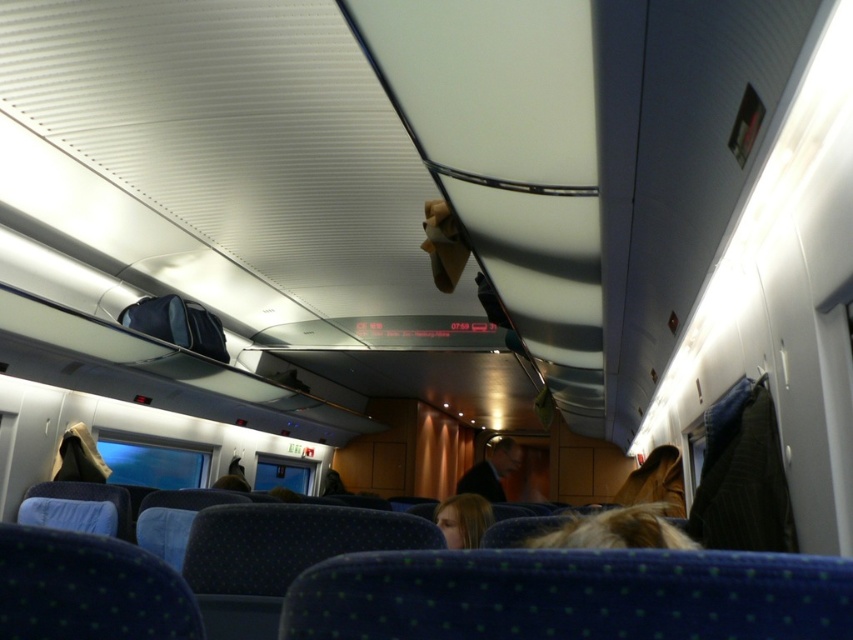
Question: From the image, what is the correct spatial relationship of blonde hair at lower center in relation to dark blue fabric jacket at center?

Choices:
 (A) below
 (B) above

Answer: (B)

Question: Does blonde hair at lower center have a lesser width compared to dark blue fabric jacket at center?

Choices:
 (A) no
 (B) yes

Answer: (B)

Question: Can you confirm if blonde hair at lower center is positioned above dark blue fabric jacket at center?

Choices:
 (A) yes
 (B) no

Answer: (A)